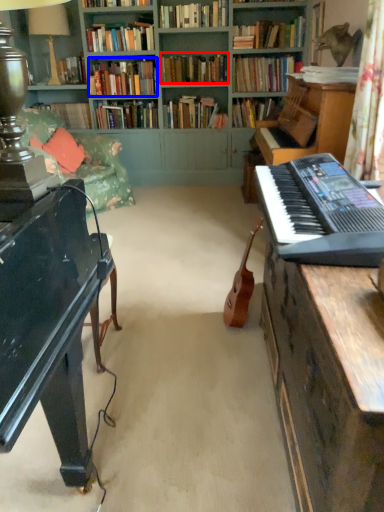
Question: Among these objects, which one is nearest to the camera, book (highlighted by a red box) or book (highlighted by a blue box)?

Choices:
 (A) book
 (B) book

Answer: (B)